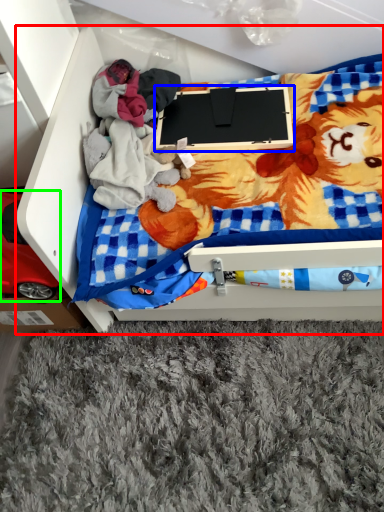
Question: Based on their relative distances, which object is farther from furniture (highlighted by a red box)? Choose from laptop (highlighted by a blue box) and toy (highlighted by a green box).

Choices:
 (A) laptop
 (B) toy

Answer: (A)